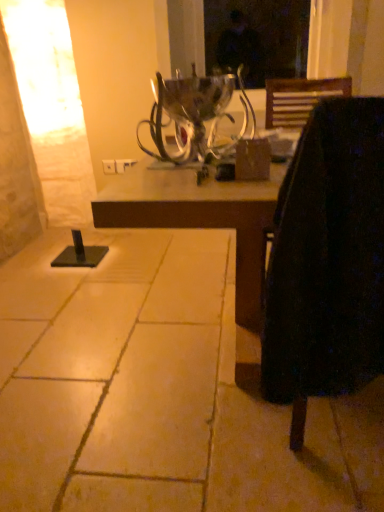
Find the location of a particular element. This screenshot has height=512, width=384. free space to the left of matte brown table at center is located at coordinates (74, 326).